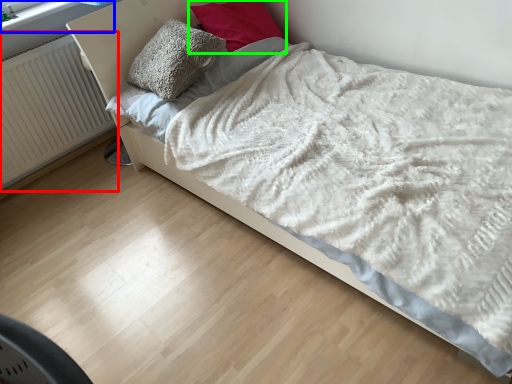
Question: Which object is the farthest from radiator (highlighted by a red box)? Choose among these: window frame (highlighted by a blue box) or pillow (highlighted by a green box).

Choices:
 (A) window frame
 (B) pillow

Answer: (B)